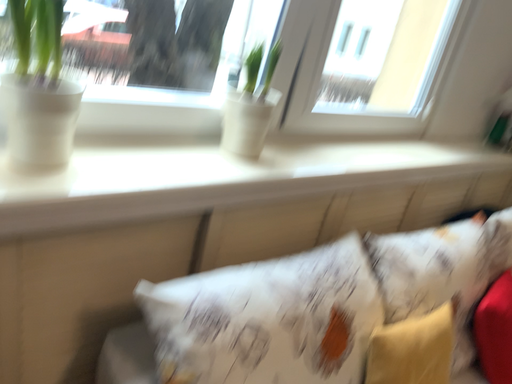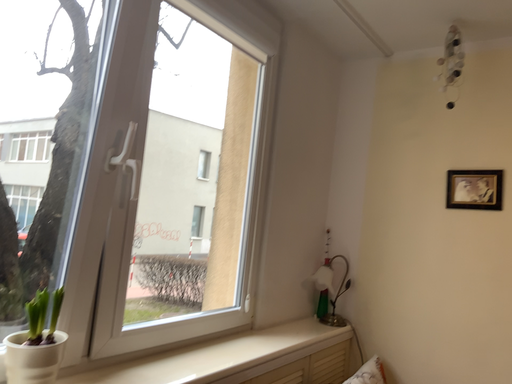
Question: Which way did the camera rotate in the video?

Choices:
 (A) rotated downward
 (B) rotated upward

Answer: (B)